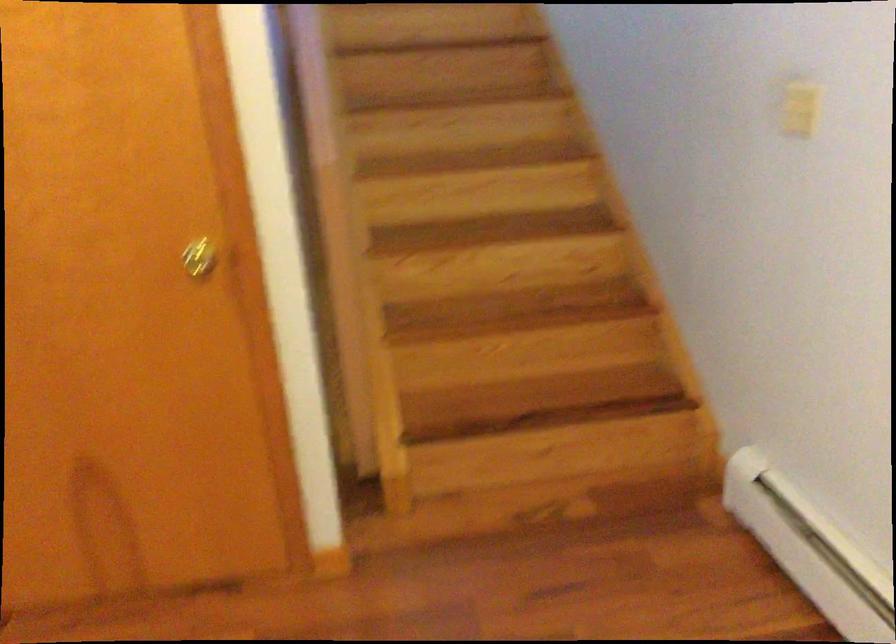
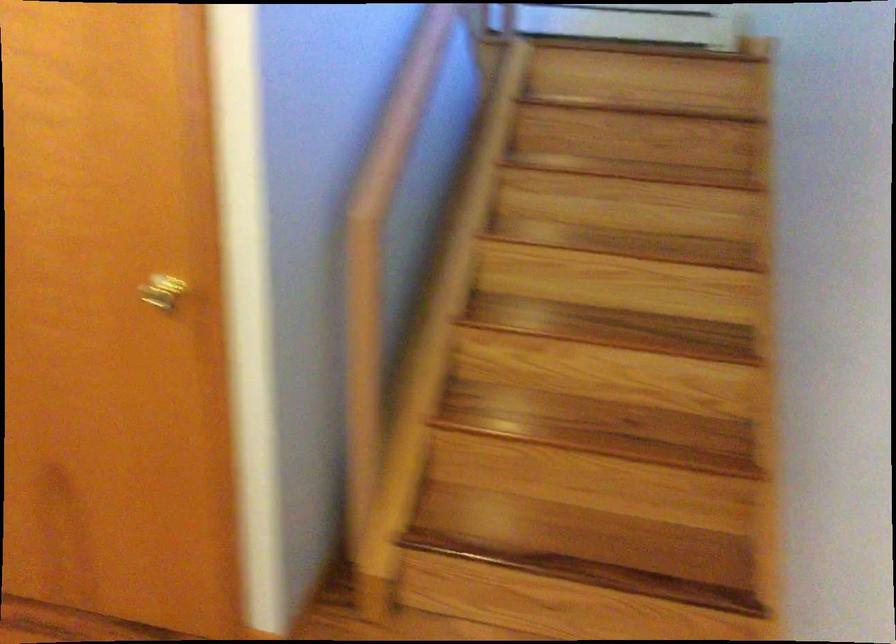
The first image is from the beginning of the video and the second image is from the end. How did the camera likely rotate when shooting the video?

The rotation direction of the camera is right-down.